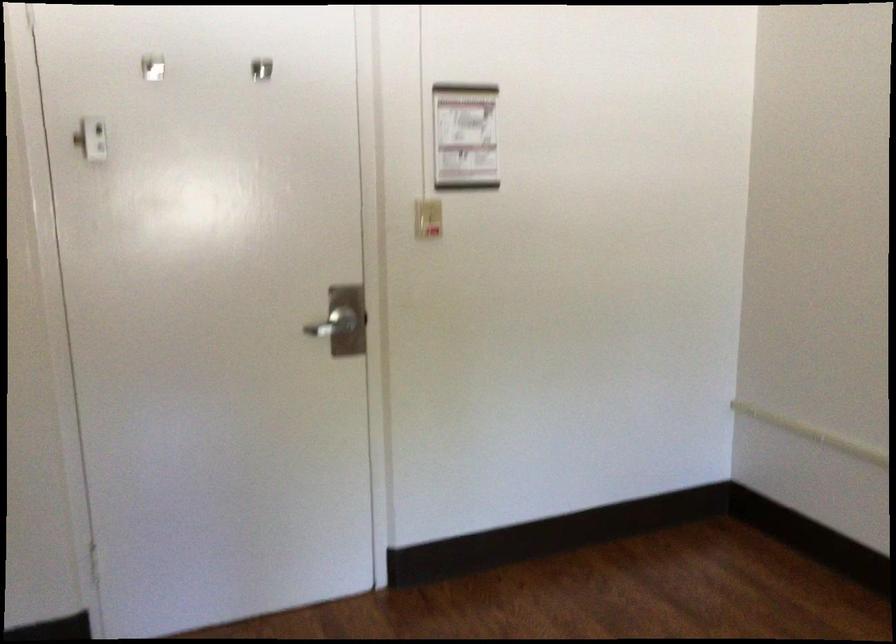
What do you see at coordinates (85, 149) in the screenshot?
I see `the white door lock` at bounding box center [85, 149].